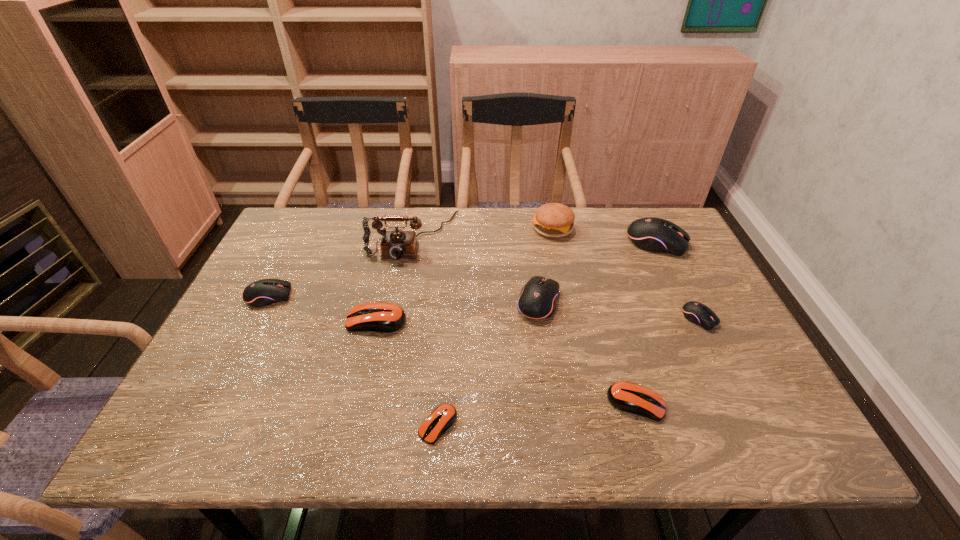
The image size is (960, 540). In the image, there is a desktop. Identify the location of free region at the near edge. (321, 445).

This screenshot has height=540, width=960. In order to click on free space at the right edge of the desktop in this screenshot , I will do `click(665, 314)`.

In the image, there is a desktop. At what (x,y) coordinates should I click in order to perform the action: click on vacant area at the far left corner. Please return your answer as a coordinate pair (x, y). This screenshot has height=540, width=960. Looking at the image, I should click on (290, 224).

The width and height of the screenshot is (960, 540). I want to click on vacant region at the far right corner, so click(639, 208).

Identify the location of free region at the near right corner. The height and width of the screenshot is (540, 960). (753, 447).

This screenshot has width=960, height=540. Find the location of `vacant space that's between the second smallest orange computer mouse and the tallest object`. vacant space that's between the second smallest orange computer mouse and the tallest object is located at coordinates (524, 320).

At what (x,y) coordinates should I click in order to perform the action: click on vacant area between the biggest black computer mouse and the biggest orange computer mouse. Please return your answer as a coordinate pair (x, y). This screenshot has width=960, height=540. Looking at the image, I should click on (516, 282).

At what (x,y) coordinates should I click in order to perform the action: click on unoccupied area between the smallest orange computer mouse and the second tallest computer mouse. Please return your answer as a coordinate pair (x, y). Looking at the image, I should click on (489, 363).

Locate an element on the screen. This screenshot has height=540, width=960. empty space that is in between the fifth tallest object and the smallest orange computer mouse is located at coordinates click(353, 361).

This screenshot has height=540, width=960. I want to click on vacant space in between the smallest black computer mouse and the fourth tallest object, so pyautogui.click(x=619, y=310).